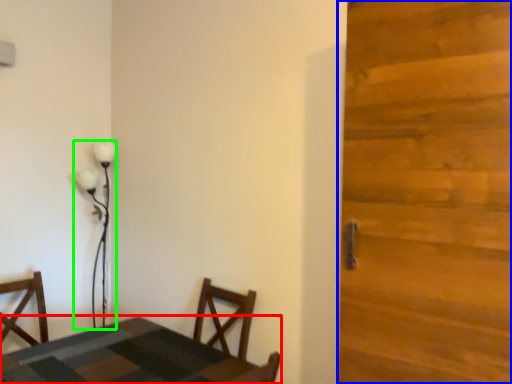
Question: Which object is positioned closest to table (highlighted by a red box)? Select from door (highlighted by a blue box) and lamp (highlighted by a green box).

Choices:
 (A) door
 (B) lamp

Answer: (A)